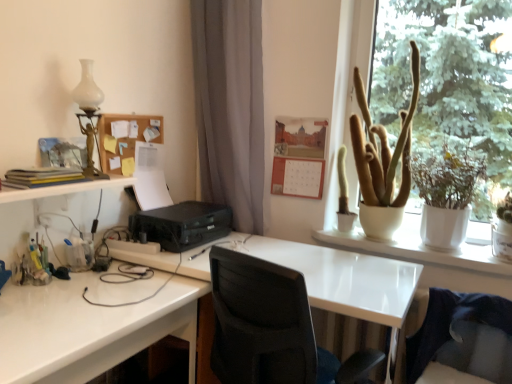
Question: In the image, is black plastic printer at center positioned in front of or behind orange matte calendar at upper center, arranged as the second bulletin board when viewed from the left?

Choices:
 (A) behind
 (B) front

Answer: (B)

Question: Looking at the image, does black plastic printer at center seem bigger or smaller compared to orange matte calendar at upper center, arranged as the second bulletin board when viewed from the left?

Choices:
 (A) small
 (B) big

Answer: (B)

Question: Which of these objects is positioned farthest from the white ceramic pot at upper right?

Choices:
 (A) white glossy desk at lower left, the second desk in the right-to-left sequence
 (B) white glass table lamp at upper left
 (C) orange matte calendar at upper center, arranged as the 1th bulletin board when viewed from the right
 (D) white glossy table at upper right
 (E) matte yellow book at left

Answer: (E)

Question: Which of these objects is positioned closest to the green matte plant at upper right?

Choices:
 (A) matte yellow book at left
 (B) white glass table lamp at upper left
 (C) white glossy desk at center, positioned as the second desk in left-to-right order
 (D) black plastic printer at center
 (E) white glossy desk at lower left, which is the first desk from left to right

Answer: (D)